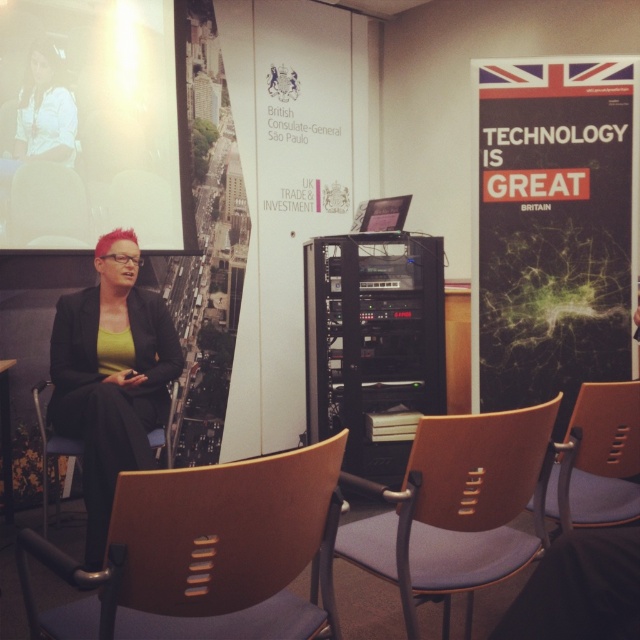
Question: Among these objects, which one is nearest to the camera?

Choices:
 (A) matte black poster at right
 (B) wooden chair with blue cushion at center
 (C) blue fabric chair at center

Answer: (C)

Question: Which point is farther from the camera taking this photo?

Choices:
 (A) (67, 124)
 (B) (93, 296)

Answer: (A)

Question: Is matte black jacket at center closer to camera compared to white matte shirt at upper left?

Choices:
 (A) yes
 (B) no

Answer: (A)

Question: In this image, where is matte black poster at right located relative to white matte shirt at upper left?

Choices:
 (A) below
 (B) above

Answer: (A)

Question: Is matte black poster at right to the left of matte black jacket at center from the viewer's perspective?

Choices:
 (A) no
 (B) yes

Answer: (A)

Question: Which is farther from the wooden chair with blue cushion at center?

Choices:
 (A) matte black poster at right
 (B) blue fabric chair at center
 (C) matte white screen at upper left

Answer: (C)